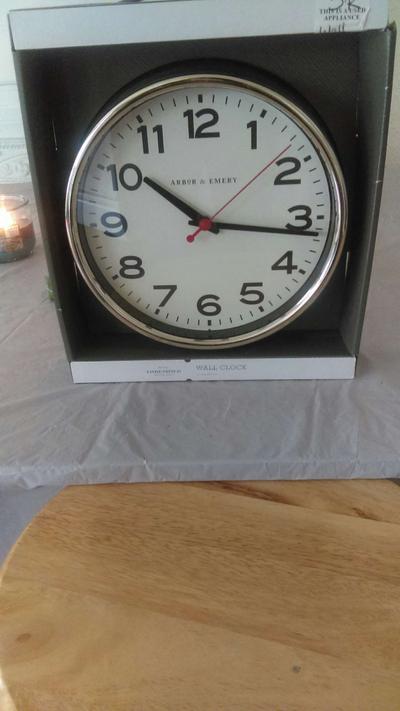
Where is `sticker`? This screenshot has width=400, height=711. sticker is located at coordinates (346, 18).